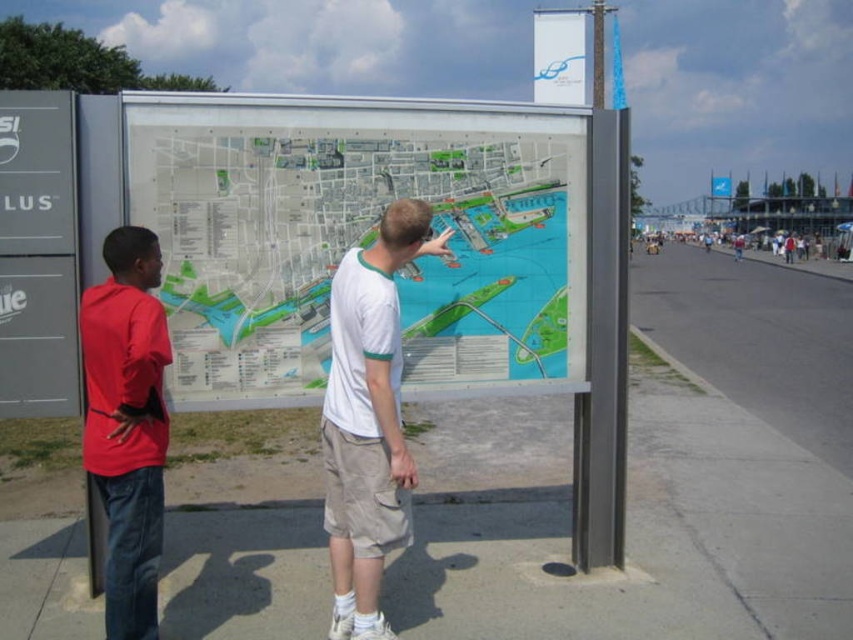
Question: Which object appears farthest from the camera in this image?

Choices:
 (A) red cotton shirt at left
 (B) metallic gray sign at left

Answer: (B)

Question: Considering the relative positions of red cotton shirt at left and metallic gray sign at left in the image provided, where is red cotton shirt at left located with respect to metallic gray sign at left?

Choices:
 (A) right
 (B) left

Answer: (A)

Question: Is red cotton shirt at left wider than metallic gray sign at left?

Choices:
 (A) no
 (B) yes

Answer: (B)

Question: Does transparent plastic map at center appear on the left side of metallic gray sign at left?

Choices:
 (A) no
 (B) yes

Answer: (A)

Question: Which object is the closest to the metallic gray sign at left?

Choices:
 (A) white paper map at center
 (B) transparent plastic map at center

Answer: (A)

Question: Which point is farther to the camera?

Choices:
 (A) white plastic banner at upper center
 (B) transparent plastic map at center

Answer: (A)